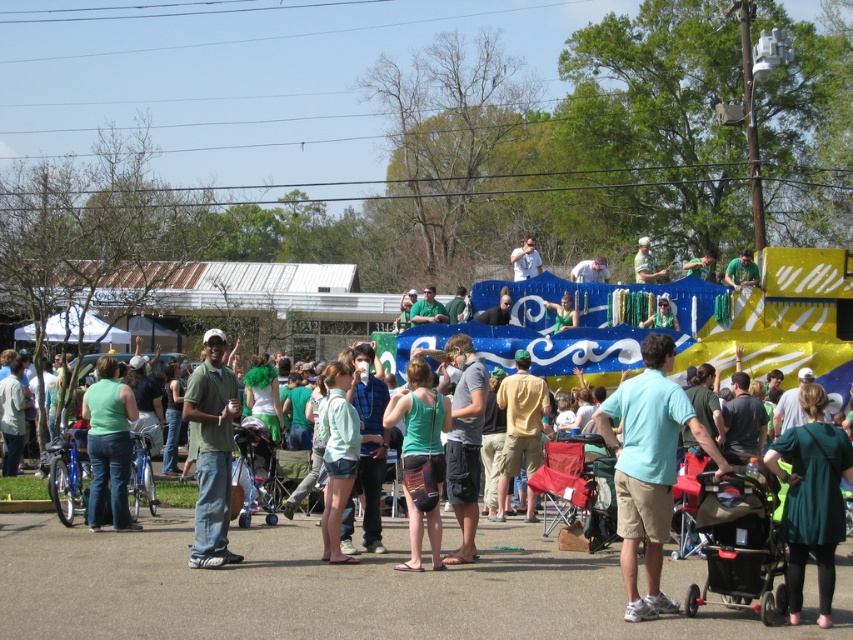
Which is in front, point (730, 483) or point (212, 480)?

Point (730, 483)

Which is more to the right, black plastic stroller at center or green matte shirt at center?

Positioned to the right is black plastic stroller at center.

Which is in front, point (759, 492) or point (202, 500)?

Positioned in front is point (759, 492).

The height and width of the screenshot is (640, 853). Find the location of `black plastic stroller at center`. black plastic stroller at center is located at coordinates (738, 547).

Consider the image. Does green dress at center have a greater height compared to green fabric shorts at center?

Incorrect, green dress at center's height is not larger of green fabric shorts at center's.

Locate an element on the screen. This screenshot has width=853, height=640. green dress at center is located at coordinates [811, 499].

Locate an element on the screen. The image size is (853, 640). green dress at center is located at coordinates (811, 499).

In the scene shown: Who is higher up, green dress at center or black plastic stroller at center?

Positioned higher is green dress at center.

Which of these two, green dress at center or black plastic stroller at center, stands shorter?

With less height is black plastic stroller at center.

Find the location of `green dress at center`. green dress at center is located at coordinates (811, 499).

Where is `green dress at center`? Image resolution: width=853 pixels, height=640 pixels. green dress at center is located at coordinates (811, 499).